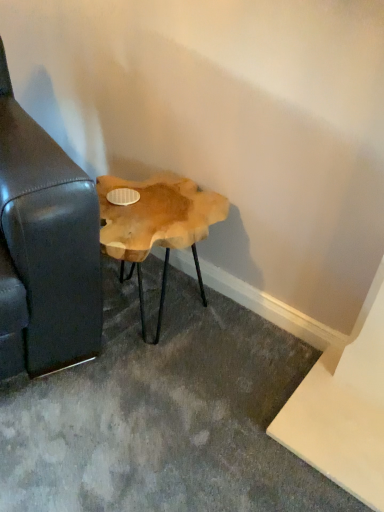
This screenshot has width=384, height=512. What do you see at coordinates (45, 248) in the screenshot?
I see `black leather couch at left` at bounding box center [45, 248].

Image resolution: width=384 pixels, height=512 pixels. In order to click on black leather couch at left in this screenshot , I will do `click(45, 248)`.

Measure the distance between black leather couch at left and camera.

They are 38.22 inches apart.

What do you see at coordinates (157, 224) in the screenshot? I see `natural wood side table at lower left` at bounding box center [157, 224].

In order to face natural wood side table at lower left, should I rotate leftwards or rightwards?

A 6.270 degree turn to the left will do.

Locate an element on the screen. natural wood side table at lower left is located at coordinates (157, 224).

Image resolution: width=384 pixels, height=512 pixels. I want to click on black leather couch at left, so click(x=45, y=248).

Which object is positioned more to the right, natural wood side table at lower left or black leather couch at left?

natural wood side table at lower left.

Is natural wood side table at lower left in front of or behind black leather couch at left in the image?

In the image, natural wood side table at lower left appears behind black leather couch at left.

Is point (176, 197) farther from viewer compared to point (76, 185)?

Yes, point (176, 197) is behind point (76, 185).

From the image's perspective, between natural wood side table at lower left and black leather couch at left, who is located below?

natural wood side table at lower left, from the image's perspective.

From a real-world perspective, which is physically below, natural wood side table at lower left or black leather couch at left?

natural wood side table at lower left.

Is natural wood side table at lower left wider than black leather couch at left?

No.

In terms of height, does natural wood side table at lower left look taller or shorter compared to black leather couch at left?

In the image, natural wood side table at lower left appears to be shorter than black leather couch at left.

Considering the sizes of objects natural wood side table at lower left and black leather couch at left in the image provided, who is smaller, natural wood side table at lower left or black leather couch at left?

natural wood side table at lower left is smaller.

Is natural wood side table at lower left spatially inside black leather couch at left, or outside of it?

natural wood side table at lower left is spatially situated outside black leather couch at left.

Is natural wood side table at lower left next to black leather couch at left?

No, natural wood side table at lower left is not in contact with black leather couch at left.

Does natural wood side table at lower left turn towards black leather couch at left?

No, natural wood side table at lower left is not facing towards black leather couch at left.

At what (x,y) coordinates should I click in order to perform the action: click on studio couch above the natural wood side table at lower left (from a real-world perspective). Please return your answer as a coordinate pair (x, y). This screenshot has height=512, width=384. Looking at the image, I should click on (45, 248).

Is black leather couch at left at the right side of natural wood side table at lower left?

No.

Between black leather couch at left and natural wood side table at lower left, which one is positioned behind?

natural wood side table at lower left is more distant.

Between point (64, 254) and point (200, 289), which one is positioned behind?

The point (200, 289) is behind.

From the image's perspective, which one is positioned higher, black leather couch at left or natural wood side table at lower left?

black leather couch at left is shown above in the image.

From a real-world perspective, is black leather couch at left positioned above or below natural wood side table at lower left?

black leather couch at left is situated higher than natural wood side table at lower left in the real world.

Can you confirm if black leather couch at left is thinner than natural wood side table at lower left?

No.

Can you confirm if black leather couch at left is taller than natural wood side table at lower left?

Yes, black leather couch at left is taller than natural wood side table at lower left.

Considering the sizes of black leather couch at left and natural wood side table at lower left in the image, is black leather couch at left bigger or smaller than natural wood side table at lower left?

Considering their sizes, black leather couch at left takes up more space than natural wood side table at lower left.

Is black leather couch at left not inside natural wood side table at lower left?

Absolutely, black leather couch at left is external to natural wood side table at lower left.

Is black leather couch at left touching natural wood side table at lower left?

black leather couch at left is not next to natural wood side table at lower left, and they're not touching.

Is black leather couch at left oriented away from natural wood side table at lower left?

That's not correct — black leather couch at left is not looking away from natural wood side table at lower left.

How many degrees apart are the facing directions of black leather couch at left and natural wood side table at lower left?

The facing directions of black leather couch at left and natural wood side table at lower left are 11.6 degrees apart.

The width and height of the screenshot is (384, 512). Identify the location of table on the right side of black leather couch at left. (157, 224).

Locate an element on the screen. Image resolution: width=384 pixels, height=512 pixels. table lying on the right of black leather couch at left is located at coordinates (157, 224).

Find the location of a particular element. The width and height of the screenshot is (384, 512). table that is below the black leather couch at left (from the image's perspective) is located at coordinates (157, 224).